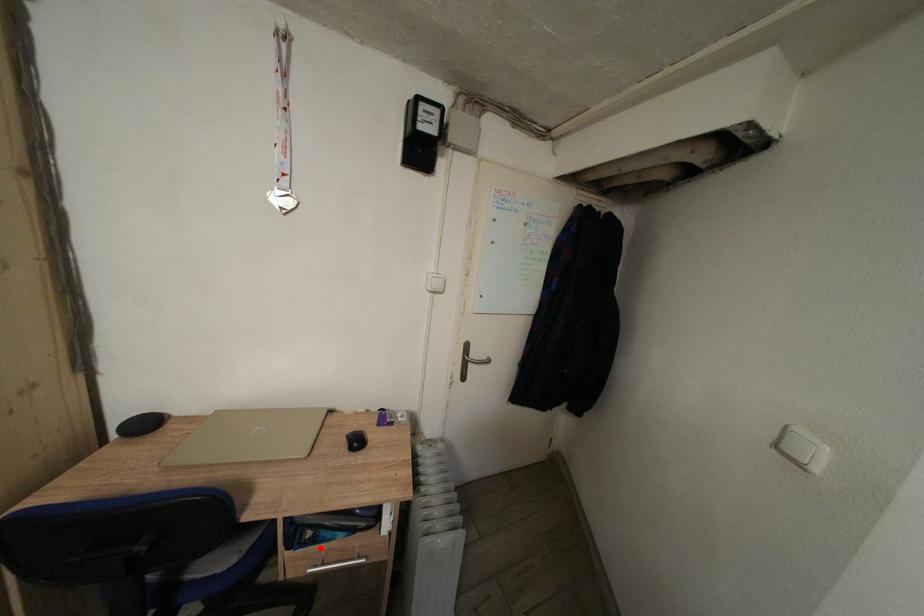
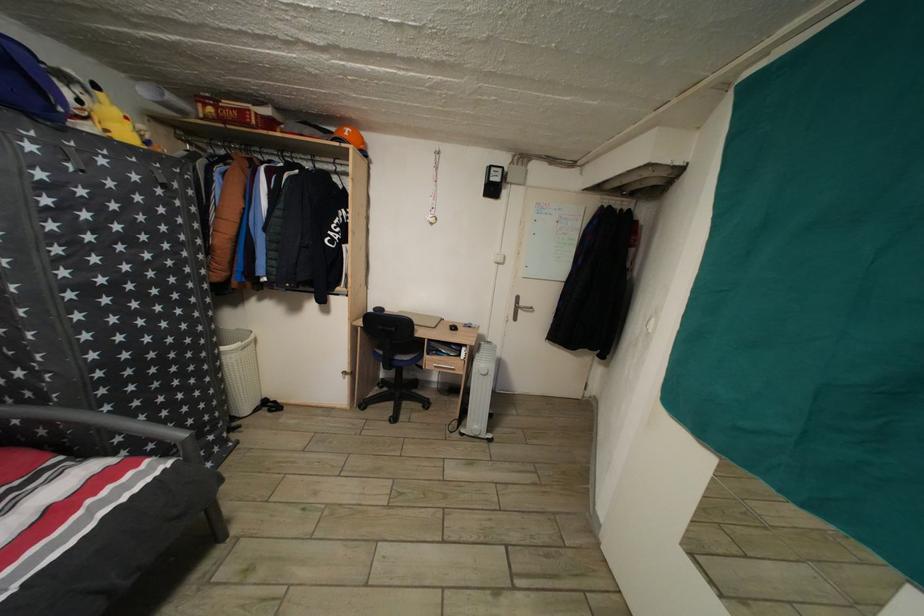
Where in the second image is the point corresponding to the highlighted location from the first image?

(443, 361)